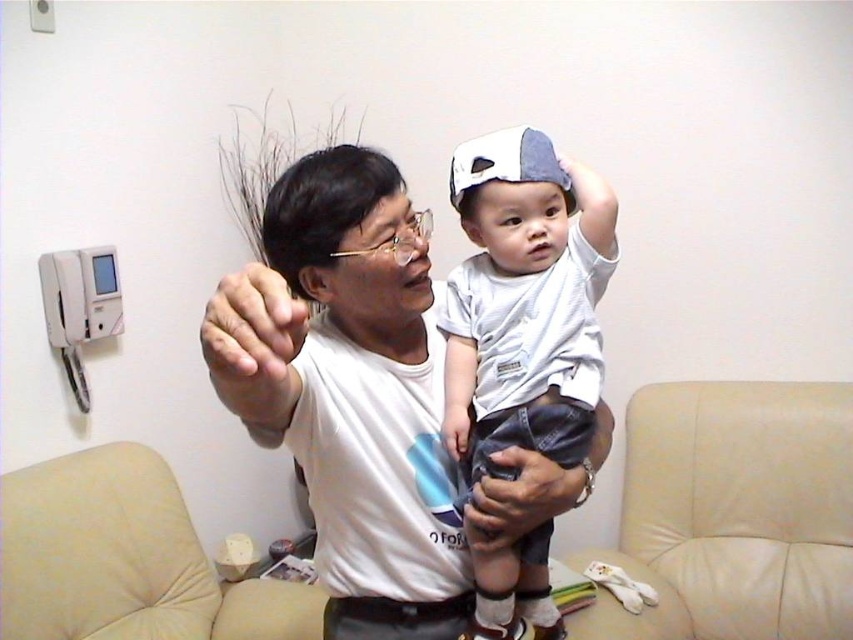
You are a photographer setting up a shoot in the living room scene. You need to position a small prop between the white matte hand at center and the black leather pants at lower center. Where should you place it to ensure it is between them?

Place the prop below the white matte hand at center and above the black leather pants at lower center since the hand is above the pants.

You are a tailor measuring the white cotton shirt at center and the matte gray hand at center. Which object has a greater width?

The white cotton shirt at center has a greater width than the matte gray hand at center according to the description.